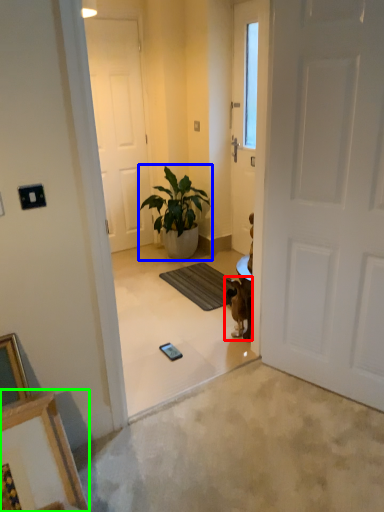
Question: Which object is the farthest from animal (highlighted by a red box)? Choose among these: houseplant (highlighted by a blue box) or picture frame (highlighted by a green box).

Choices:
 (A) houseplant
 (B) picture frame

Answer: (B)